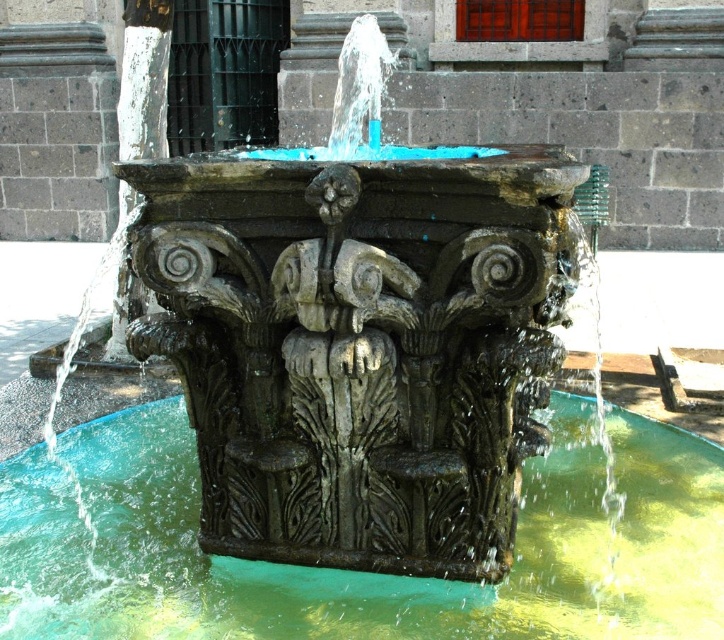
Question: Is green polished water at center wider than carved stone figure at center?

Choices:
 (A) yes
 (B) no

Answer: (A)

Question: Among these objects, which one is nearest to the camera?

Choices:
 (A) green polished water at center
 (B) carved stone figure at center

Answer: (B)

Question: Among these points, which one is farthest from the camera?

Choices:
 (A) (345, 387)
 (B) (602, 632)

Answer: (B)

Question: Does green polished water at center have a lesser width compared to carved stone figure at center?

Choices:
 (A) yes
 (B) no

Answer: (B)

Question: Does green polished water at center appear on the right side of carved stone figure at center?

Choices:
 (A) yes
 (B) no

Answer: (A)